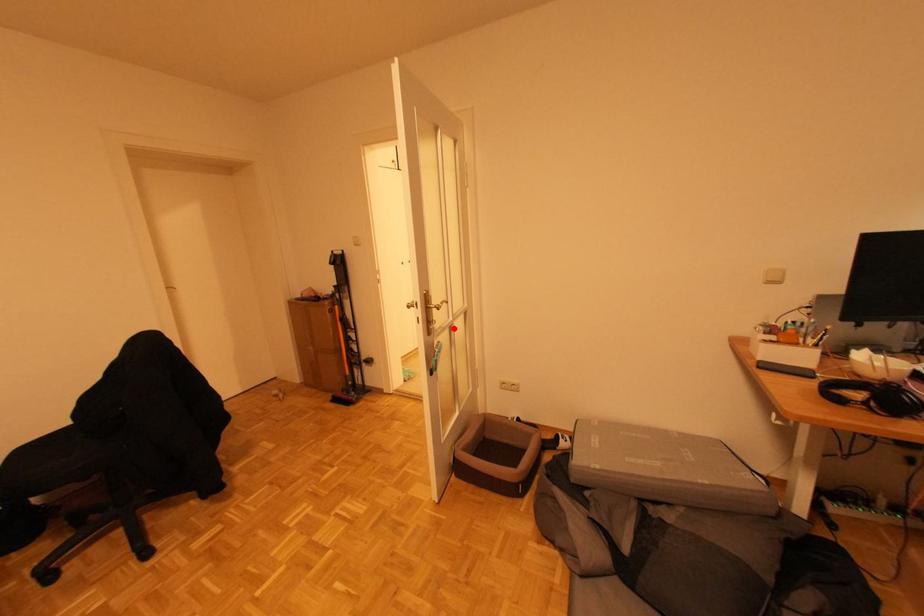
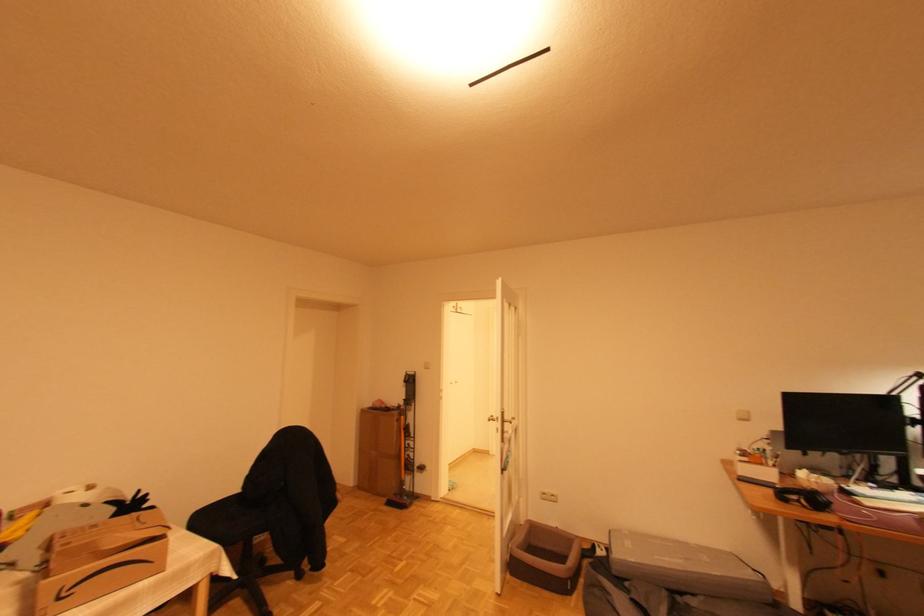
In the second image, find the point that corresponds to the highlighted location in the first image.

(513, 440)